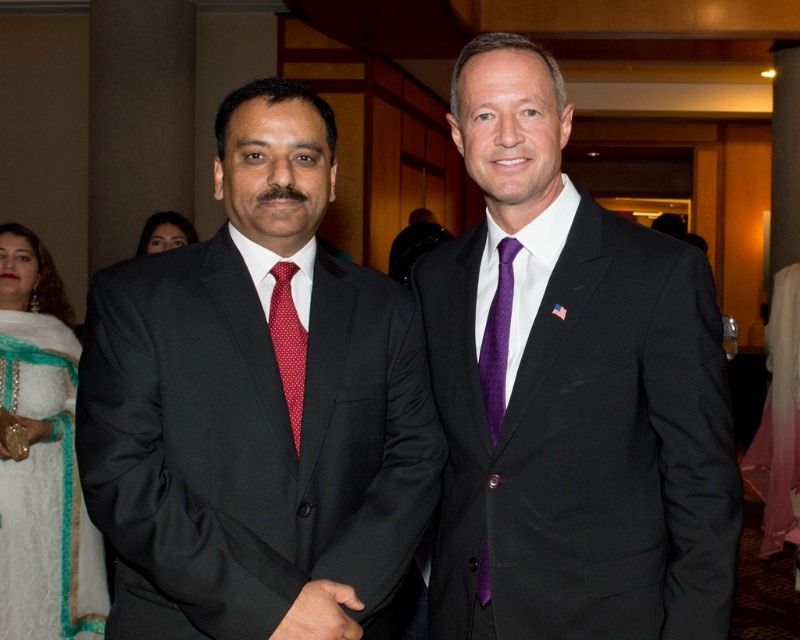
You are a photographer at a formal event. You need to capture a closeup shot of the purple satin suit at center and the red dotted fabric tie at left. The camera you are using has a minimum focusing distance of 60 centimeters. Will you be able to take the photo without moving either object?

The distance between the purple satin suit at center and the red dotted fabric tie at left is 58.62 centimeters. Since the minimum focusing distance of the camera is 60 centimeters, you will not be able to take the closeup shot without moving the objects closer together or adjusting the camera settings to accommodate the shorter distance.

You are taking a photo of two men at a formal event. The first man is at point (322, 257) and the second man is at point (286, 380). If you want to focus on the man who is closer to the camera, which point should you focus on?

You should focus on point (286, 380) because it is closer to the camera than point (322, 257).

You are a photographer standing at the camera position. You want to take a photo of the two men. However, there is a light pole at point (554,355) that might block your view. Is the light pole closer to you than the two men?

The distance of point (554,355) from camera is 1.69 meters. Since the two men are the main subjects in the image and typically stand at a reasonable distance for a portrait, the light pole at point (554,355) is likely closer to you than the two men, potentially blocking their view.